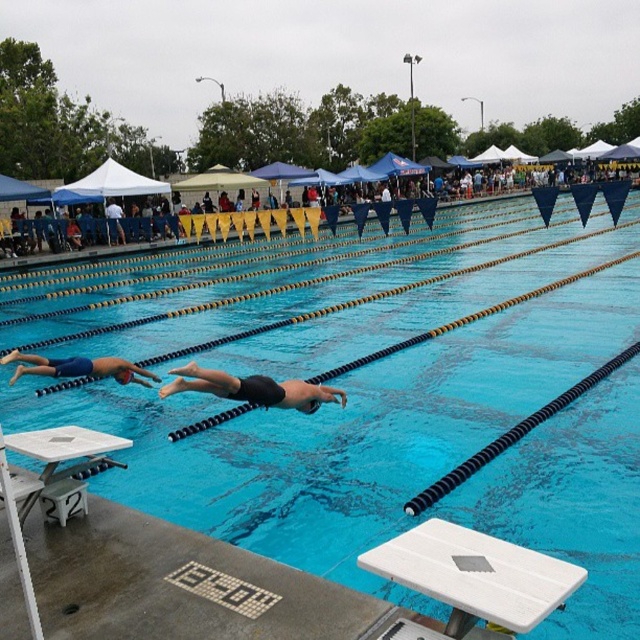
You are a lifeguard standing on the pool deck. You notice the blue rubber lane dividers at center and the white plastic diving board at lower center. Which object is wider in terms of their width?

The blue rubber lane dividers at center might be wider than white plastic diving board at lower center, so the blue rubber lane dividers at center are wider.

You are a lifeguard observing the pool. You notice two swimmers in the water. The smooth black swimmer at center and the blue matte swimmer at left. Which swimmer is closer to the starting blocks numbered 2 and 3 on the left side?

The blue matte swimmer at left is closer to the starting blocks numbered 2 and 3 on the left side because it is positioned to the left of the smooth black swimmer at center, which is above it.

You are a lifeguard observing the pool during the race. You notice the blue rubber lane dividers at center and the smooth black swimmer at center. Which object is taller from your viewpoint?

The smooth black swimmer at center is taller than the blue rubber lane dividers at center.